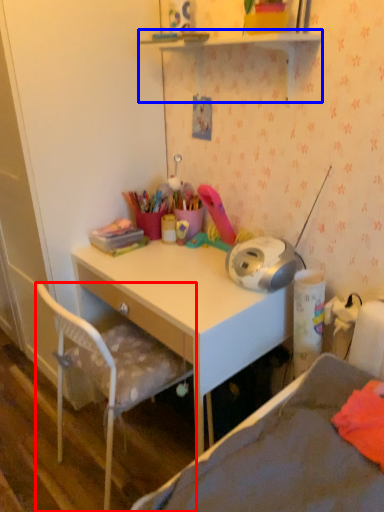
Question: Which object is closer to the camera taking this photo, chair (highlighted by a red box) or shelf (highlighted by a blue box)?

Choices:
 (A) chair
 (B) shelf

Answer: (B)